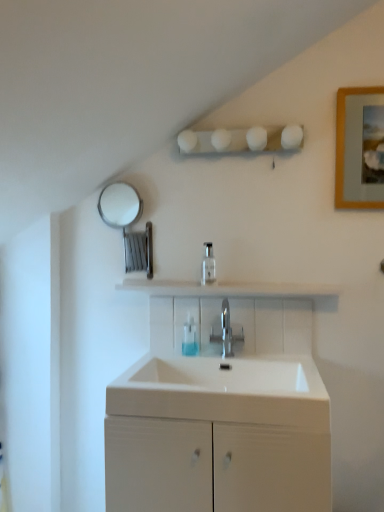
Where is `vacant space situated above white glossy shelf at center (from a real-world perspective)`? vacant space situated above white glossy shelf at center (from a real-world perspective) is located at coordinates (231, 280).